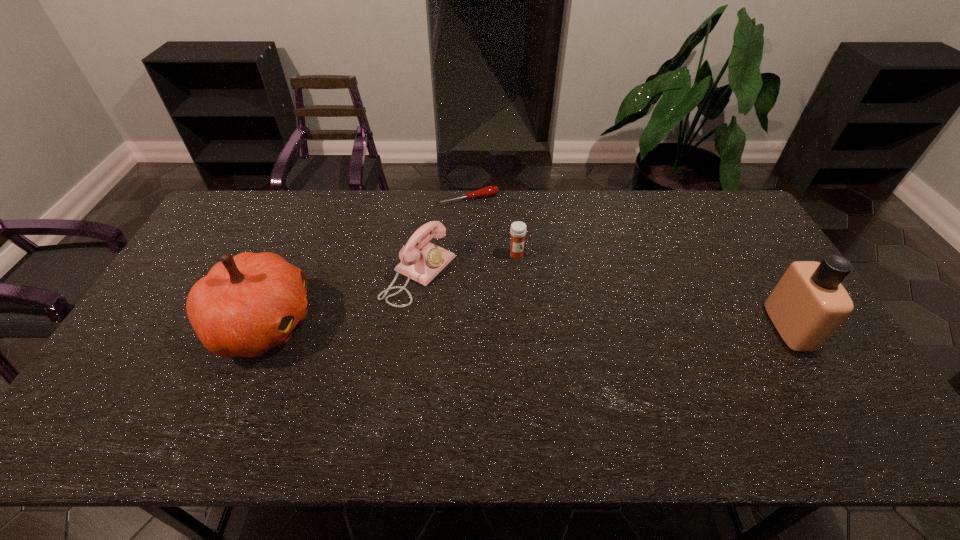
The height and width of the screenshot is (540, 960). In order to click on vacant position located on the label side of the second object from right to left in this screenshot , I will do `click(572, 315)`.

You are a GUI agent. You are given a task and a screenshot of the screen. Output one action in this format:
    pyautogui.click(x=<x>, y=<y>)
    Task: Click on the blank area located at the tip of the screwdriver
    The height and width of the screenshot is (540, 960).
    Given the screenshot: What is the action you would take?
    pyautogui.click(x=514, y=263)

Where is `free region located 0.170m at the tip of the screwdriver`? This screenshot has height=540, width=960. free region located 0.170m at the tip of the screwdriver is located at coordinates (496, 236).

Identify the location of free space located at the tip of the screwdriver. The width and height of the screenshot is (960, 540). (522, 278).

Find the location of a particular element. The width and height of the screenshot is (960, 540). free region located on the dial of the telephone is located at coordinates (572, 354).

At what (x,y) coordinates should I click in order to perform the action: click on vacant space located on the dial of the telephone. Please return your answer as a coordinate pair (x, y). The width and height of the screenshot is (960, 540). Looking at the image, I should click on (525, 330).

Where is `free space located 0.310m on the dial of the telephone`? This screenshot has height=540, width=960. free space located 0.310m on the dial of the telephone is located at coordinates pos(541,339).

This screenshot has height=540, width=960. I want to click on object that is at the far edge, so click(488, 191).

Locate an element on the screen. The width and height of the screenshot is (960, 540). object positioned at the near edge is located at coordinates [247, 304].

Where is `object that is at the right edge`? object that is at the right edge is located at coordinates tap(809, 303).